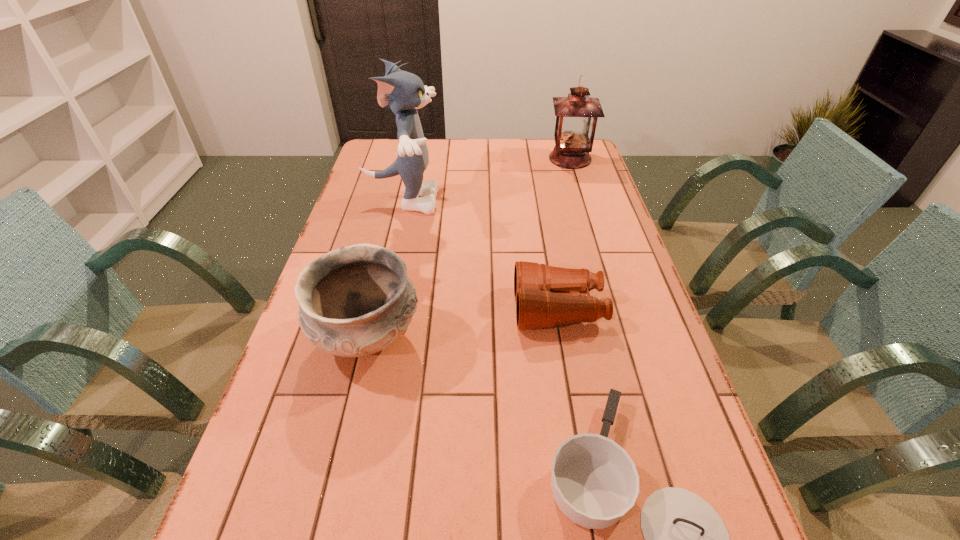
At what (x,y) coordinates should I click in order to perform the action: click on vacant region at the right edge. Please return your answer as a coordinate pair (x, y). Looking at the image, I should click on (608, 191).

What are the coordinates of `empty space that is in between the cat and the binoculars` in the screenshot? It's located at (480, 255).

In order to click on unoccupied position between the pottery and the binoculars in this screenshot , I will do `click(463, 323)`.

This screenshot has width=960, height=540. Identify the location of free spot between the fourth shortest object and the second shortest object. (564, 234).

Identify the location of empty location between the cat and the fourth shortest object. (486, 180).

At what (x,y) coordinates should I click in order to perform the action: click on vacant area between the binoculars and the second tallest object. Please return your answer as a coordinate pair (x, y). Looking at the image, I should click on (564, 234).

Find the location of a particular element. object that can be found as the second closest to the oil lamp is located at coordinates pyautogui.click(x=546, y=296).

Find the location of a particular element. The width and height of the screenshot is (960, 540). the fourth closest object relative to the third tallest object is located at coordinates (576, 115).

Where is `free space that satisfies the following two spatial constraints: 1. on the front side of the oil lamp; 2. on the front-facing side of the cat`? free space that satisfies the following two spatial constraints: 1. on the front side of the oil lamp; 2. on the front-facing side of the cat is located at coordinates (583, 201).

Find the location of `vacant space that satisfies the following two spatial constraints: 1. on the back side of the third tallest object; 2. on the left side of the second tallest object`. vacant space that satisfies the following two spatial constraints: 1. on the back side of the third tallest object; 2. on the left side of the second tallest object is located at coordinates (410, 159).